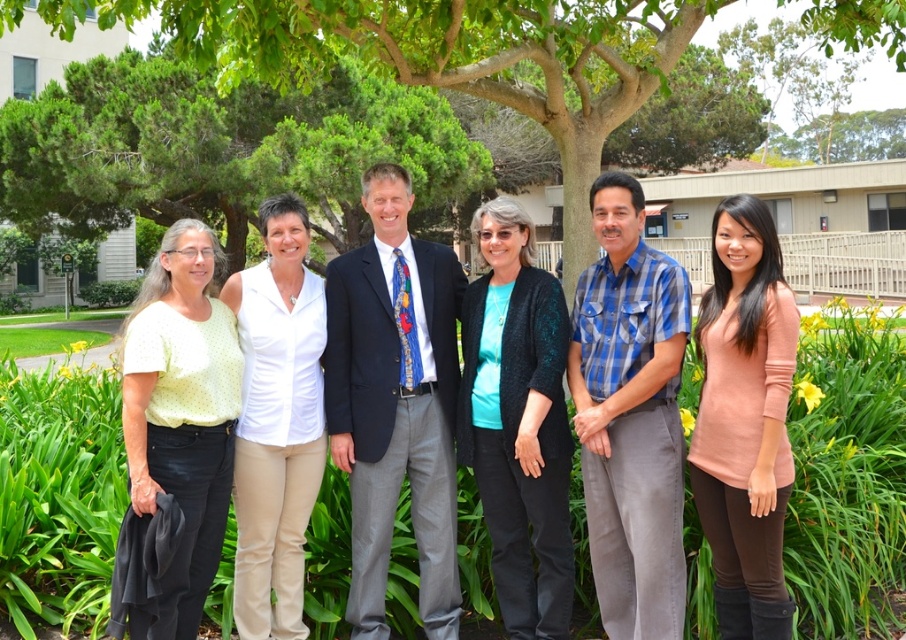
Looking at this image, you are standing in a park and want to take a photo of the green leafy tree at center. If your camera can focus on objects up to 3 meters away, will you need to move closer or farther away to capture the tree clearly?

The green leafy tree at center is 3.44 meters away from the viewer. Since your camera can focus up to 3 meters, you need to move closer to the tree to ensure it is within the camera range.

You are a photographer trying to capture a group photo of the matte white blouse at center and the light yellow dotted blouse at left. Since you want to ensure both subjects are clearly visible, which blouse should you focus on first based on their positions?

The matte white blouse at center is positioned on the right side of light yellow dotted blouse at left, so you should focus on the light yellow dotted blouse at left first as it is closer to the left side and might be in the foreground.

You are a photographer adjusting the camera settings to ensure all subjects are in focus. Given that the light yellow dotted blouse at left and the white smooth shirt at center are in your frame, which one requires more careful adjustment due to its size?

The light yellow dotted blouse at left requires more careful adjustment because it is larger in size than the white smooth shirt at center, making it more prominent in the frame and necessitating precise focus.